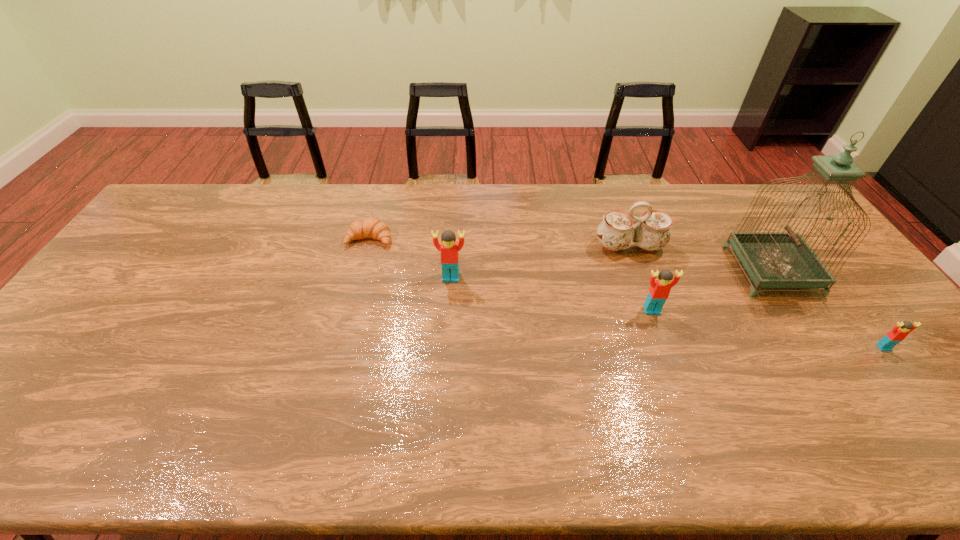
Considering the uniform spacing of Legos, where should an additional Lego be positioned on the left? Please locate a free spot. Please provide its 2D coordinates. Your answer should be formatted as a tuple, i.e. [(x, y)], where the tuple contains the x and y coordinates of a point satisfying the conditions above.

[(276, 249)]